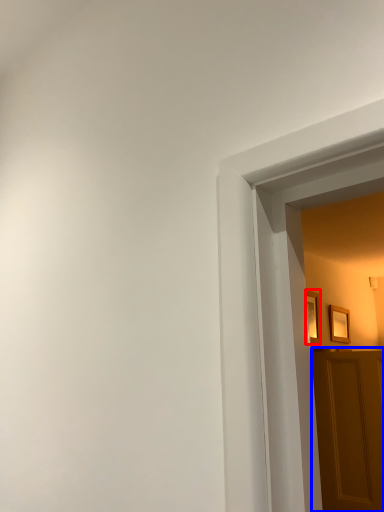
Question: Which of the following is the closest to the observer, picture frame (highlighted by a red box) or door (highlighted by a blue box)?

Choices:
 (A) picture frame
 (B) door

Answer: (B)